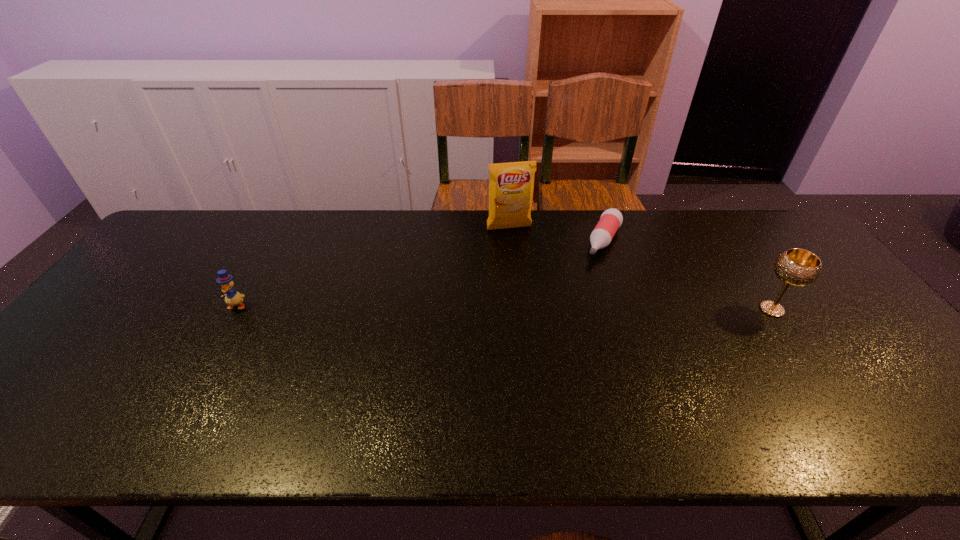
I want to click on free region at the left edge of the desktop, so click(x=129, y=343).

Identify the location of vacant space at the right edge of the desktop. (792, 292).

The image size is (960, 540). Identify the location of vacant region at the far left corner. (197, 211).

Find the location of a particular element. The image size is (960, 540). blank region between the second object from left to right and the second shortest object is located at coordinates (372, 267).

You are a GUI agent. You are given a task and a screenshot of the screen. Output one action in this format:
    pyautogui.click(x=<x>, y=<y>)
    Task: Click on the unoccupied area between the bottle and the second object from left to right
    This screenshot has width=960, height=540.
    Given the screenshot: What is the action you would take?
    pyautogui.click(x=556, y=234)

Where is `unoccupied position between the third object from right to left and the third shortest object`? The height and width of the screenshot is (540, 960). unoccupied position between the third object from right to left and the third shortest object is located at coordinates (640, 269).

Identify the location of empty location between the third object from left to right and the duckling. This screenshot has height=540, width=960. (420, 273).

At what (x,y) coordinates should I click in order to perform the action: click on vacant area that lies between the crisp (potato chip) and the duckling. Please return your answer as a coordinate pair (x, y). This screenshot has width=960, height=540. Looking at the image, I should click on (372, 267).

What are the coordinates of `empty space that is in between the chalice and the tallest object` in the screenshot? It's located at (640, 269).

This screenshot has height=540, width=960. Find the location of `free space between the second shortest object and the shortest object`. free space between the second shortest object and the shortest object is located at coordinates (420, 273).